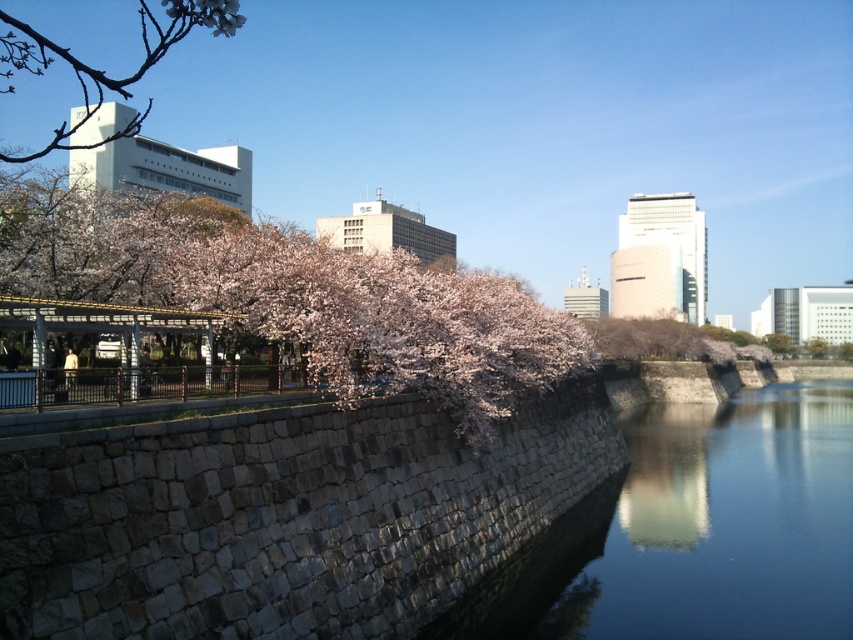
Question: From the image, what is the correct spatial relationship of smooth stone river at center in relation to pink petal blossom at upper left?

Choices:
 (A) left
 (B) right

Answer: (B)

Question: Based on their relative distances, which object is nearer to the slightly pinkish-white blossoms at upper left?

Choices:
 (A) pink blossoms at left
 (B) pink petal blossom at upper left

Answer: (A)

Question: Can you confirm if slightly pinkish-white blossoms at upper left is bigger than pink petal blossom at upper left?

Choices:
 (A) yes
 (B) no

Answer: (A)

Question: Which is farther from the pink petal blossom at upper left?

Choices:
 (A) pink blossoms at left
 (B) smooth stone river at center

Answer: (B)

Question: Which point is farther to the camera?

Choices:
 (A) (142, 205)
 (B) (173, 4)
 (C) (155, 28)
 (D) (770, 490)

Answer: (C)

Question: Does smooth stone river at center appear on the left side of slightly pinkish-white blossoms at upper left?

Choices:
 (A) yes
 (B) no

Answer: (B)